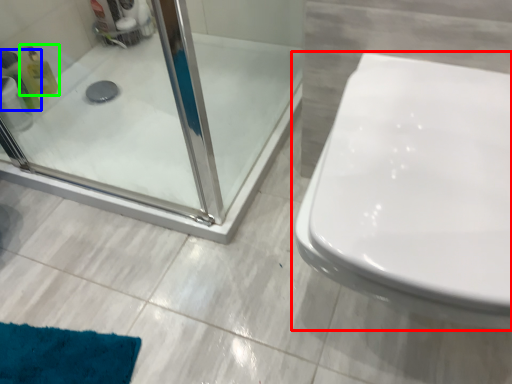
Question: Based on their relative distances, which object is farther from toilet (highlighted by a red box)? Choose from cleaning product (highlighted by a blue box) and cleaning product (highlighted by a green box).

Choices:
 (A) cleaning product
 (B) cleaning product

Answer: (B)